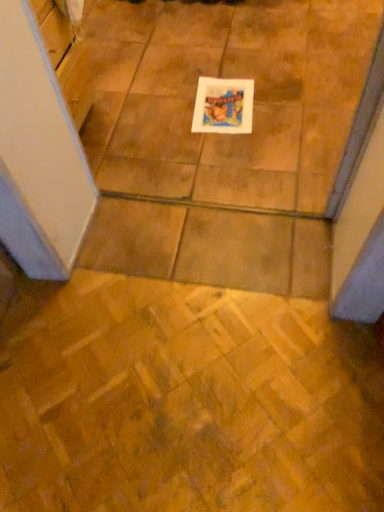
Question: From the image's perspective, is white paper at center located above or below wooden parquet floor at center?

Choices:
 (A) below
 (B) above

Answer: (B)

Question: Considering the positions of white paper at center and wooden parquet floor at center in the image, is white paper at center taller or shorter than wooden parquet floor at center?

Choices:
 (A) short
 (B) tall

Answer: (A)

Question: Considering the positions of point (220, 89) and point (340, 356), is point (220, 89) closer or farther from the camera than point (340, 356)?

Choices:
 (A) closer
 (B) farther

Answer: (B)

Question: Is wooden parquet floor at center inside the boundaries of white paper at center, or outside?

Choices:
 (A) inside
 (B) outside

Answer: (B)

Question: Would you say wooden parquet floor at center is to the left or to the right of white paper at center in the picture?

Choices:
 (A) right
 (B) left

Answer: (B)

Question: In the image, is wooden parquet floor at center positioned in front of or behind white paper at center?

Choices:
 (A) behind
 (B) front

Answer: (B)

Question: From the image's perspective, is wooden parquet floor at center located above or below white paper at center?

Choices:
 (A) below
 (B) above

Answer: (A)